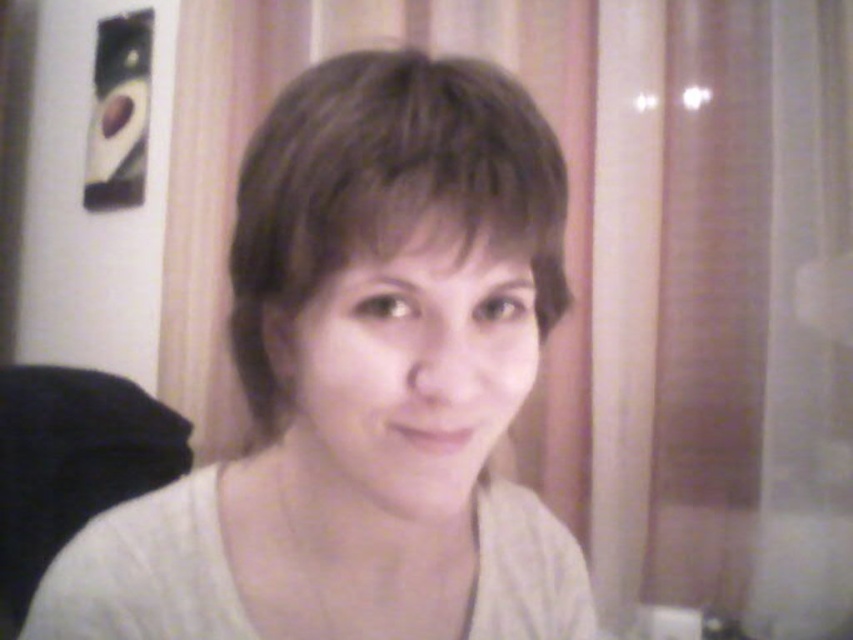
Question: Which object is closer to the camera taking this photo?

Choices:
 (A) white matte shirt at center
 (B) brown matte hair at center

Answer: (A)

Question: Which point appears farthest from the camera in this image?

Choices:
 (A) (370, 150)
 (B) (447, 394)

Answer: (B)

Question: Does white matte shirt at center come in front of brown matte hair at center?

Choices:
 (A) no
 (B) yes

Answer: (B)

Question: Does white matte shirt at center appear over brown matte hair at center?

Choices:
 (A) yes
 (B) no

Answer: (B)

Question: Among these points, which one is nearest to the camera?

Choices:
 (A) (532, 611)
 (B) (431, 147)

Answer: (B)

Question: Does white matte shirt at center appear on the left side of brown matte hair at center?

Choices:
 (A) yes
 (B) no

Answer: (B)